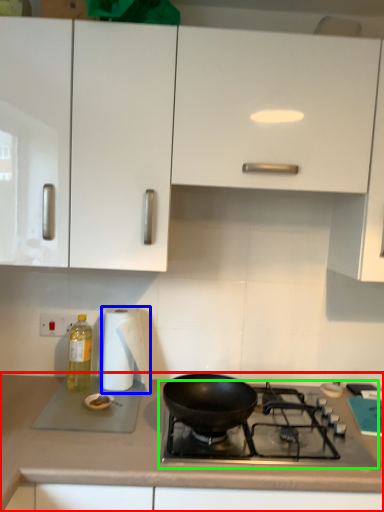
Question: Estimate the real-world distances between objects in this image. Which object is farther from countertop (highlighted by a red box), paper towel (highlighted by a blue box) or gas stove (highlighted by a green box)?

Choices:
 (A) paper towel
 (B) gas stove

Answer: (A)